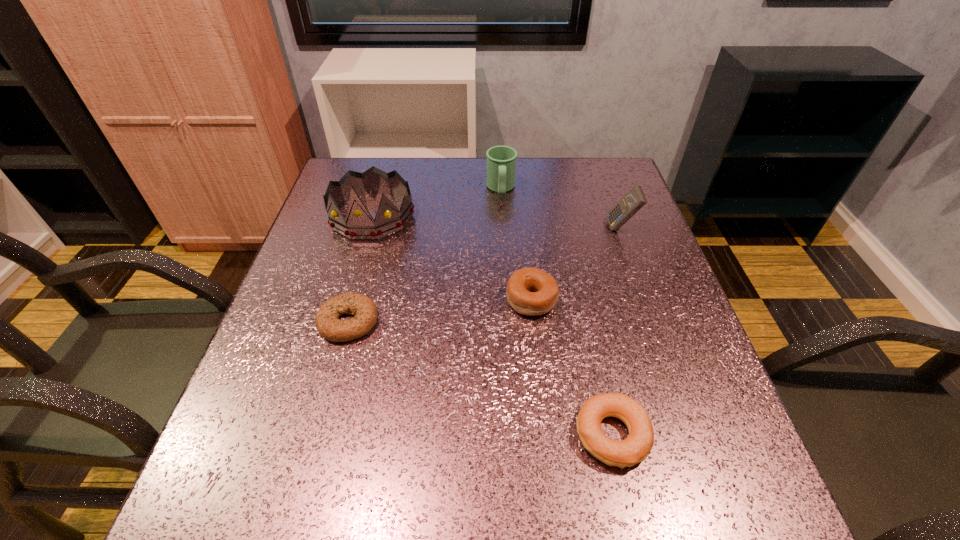
Find the location of `object situated at the far left corner`. object situated at the far left corner is located at coordinates (359, 225).

In order to click on free spot at the far edge of the desktop in this screenshot , I will do `click(413, 158)`.

In the image, there is a desktop. Where is `vacant space at the left edge`? Image resolution: width=960 pixels, height=540 pixels. vacant space at the left edge is located at coordinates (268, 362).

Find the location of a particular element. free point at the right edge is located at coordinates (607, 251).

The height and width of the screenshot is (540, 960). In the image, there is a desktop. Identify the location of free space at the far right corner. (628, 181).

You are a GUI agent. You are given a task and a screenshot of the screen. Output one action in this format:
    pyautogui.click(x=<x>, y=<y>)
    Task: Click on the empty location between the nearest object and the tiara
    This screenshot has width=960, height=540.
    Given the screenshot: What is the action you would take?
    pyautogui.click(x=492, y=325)

Find the location of a particular element. The height and width of the screenshot is (540, 960). free space between the tallest object and the third shortest object is located at coordinates (452, 258).

The image size is (960, 540). What are the coordinates of `empty space that is in between the leftmost bagel and the tiara` in the screenshot? It's located at (360, 269).

Where is `unoccupied area between the leftmost bagel and the tallest object`? unoccupied area between the leftmost bagel and the tallest object is located at coordinates (360, 269).

Identify the location of vacant space that is in between the tallest bagel and the nearest bagel. This screenshot has height=540, width=960. (572, 367).